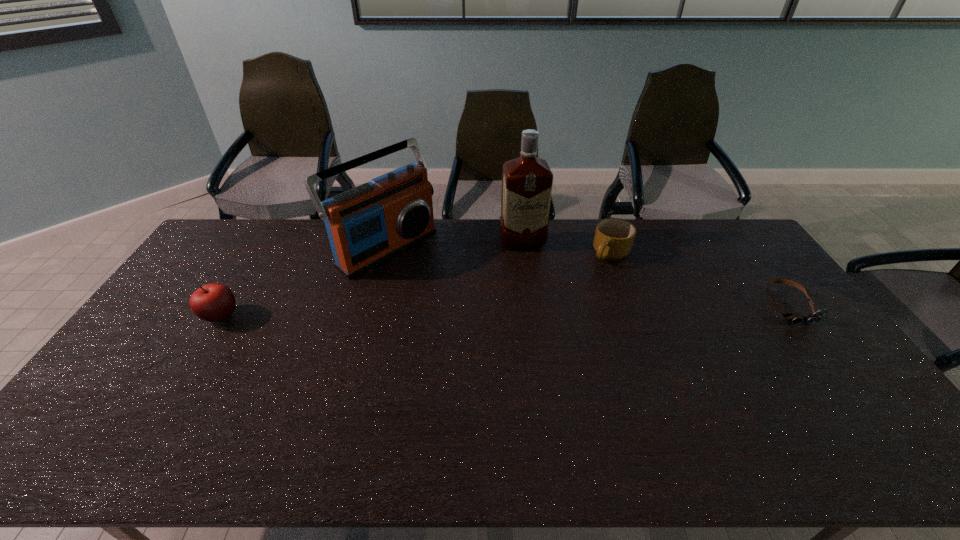
The width and height of the screenshot is (960, 540). Identify the location of vacant space at the near right corner. (823, 420).

Where is `free spot between the second shortest object and the radio receiver`? The width and height of the screenshot is (960, 540). free spot between the second shortest object and the radio receiver is located at coordinates pos(497,251).

The width and height of the screenshot is (960, 540). In order to click on free spot between the apple and the tallest object in this screenshot , I will do `click(372, 279)`.

Find the location of `vacant space that is in between the liquor and the radio receiver`. vacant space that is in between the liquor and the radio receiver is located at coordinates tap(453, 245).

Locate an element on the screen. free space between the fourth object from right to left and the tallest object is located at coordinates (453, 245).

Where is `free space that is in between the tallest object and the fourth object from left to right`? free space that is in between the tallest object and the fourth object from left to right is located at coordinates (566, 248).

Locate an element on the screen. The image size is (960, 540). free spot between the radio receiver and the leftmost object is located at coordinates (302, 282).

Image resolution: width=960 pixels, height=540 pixels. In order to click on vacant region between the goggles and the second tallest object in this screenshot , I will do `click(587, 276)`.

The image size is (960, 540). In order to click on empty space that is in between the liquor and the second object from right to left in this screenshot , I will do `click(566, 248)`.

At what (x,y) coordinates should I click in order to perform the action: click on free space between the shortest object and the fourth object from left to right. Please return your answer as a coordinate pair (x, y). Image resolution: width=960 pixels, height=540 pixels. Looking at the image, I should click on (699, 280).